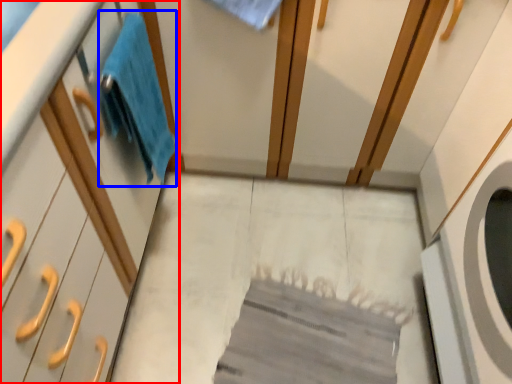
Question: Which of the following is the closest to the observer, cabinetry (highlighted by a red box) or bath towel (highlighted by a blue box)?

Choices:
 (A) cabinetry
 (B) bath towel

Answer: (A)